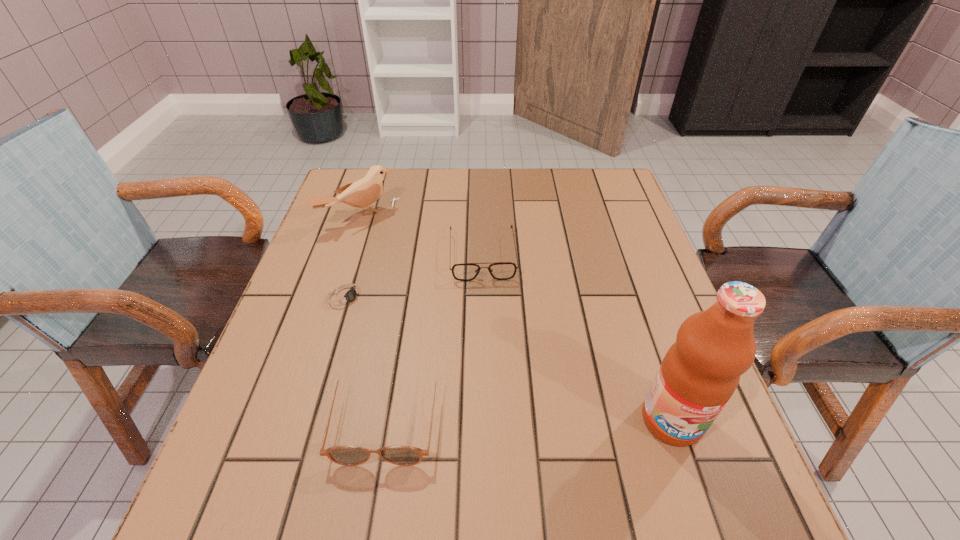
Where is `free point located 0.330m at the beak of the bird`? The image size is (960, 540). free point located 0.330m at the beak of the bird is located at coordinates (449, 299).

Locate an element on the screen. free space located 0.060m at the beak of the bird is located at coordinates (390, 241).

At what (x,y) coordinates should I click in order to perform the action: click on free spot located at the beak of the bird. Please return your answer as a coordinate pair (x, y). The image size is (960, 540). Looking at the image, I should click on (390, 241).

This screenshot has width=960, height=540. I want to click on vacant area situated 0.340m on the front-facing side of the fourth object from left to right, so click(x=492, y=409).

Where is `blank area located on the front-facing side of the fourth object from left to right`? The image size is (960, 540). blank area located on the front-facing side of the fourth object from left to right is located at coordinates (492, 395).

Where is `free space located 0.160m on the front-facing side of the fourth object from left to right`? The height and width of the screenshot is (540, 960). free space located 0.160m on the front-facing side of the fourth object from left to right is located at coordinates (488, 334).

The width and height of the screenshot is (960, 540). What are the coordinates of `object that is at the far edge` in the screenshot? It's located at (363, 193).

Find the location of `sunglasses at the near edge`. sunglasses at the near edge is located at coordinates (344, 455).

This screenshot has width=960, height=540. I want to click on fruit juice at the near edge, so click(700, 372).

Identify the location of watch that is at the left edge. (344, 296).